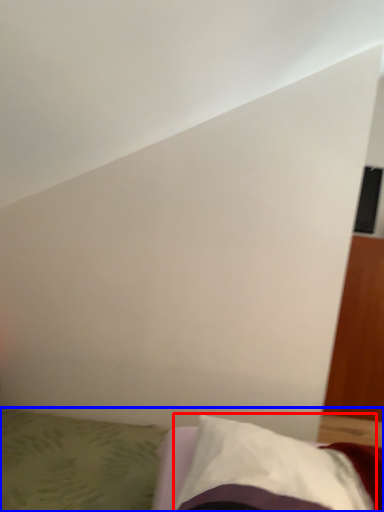
Question: Which point is further to the camera, pillow (highlighted by a red box) or bed (highlighted by a blue box)?

Choices:
 (A) pillow
 (B) bed

Answer: (B)